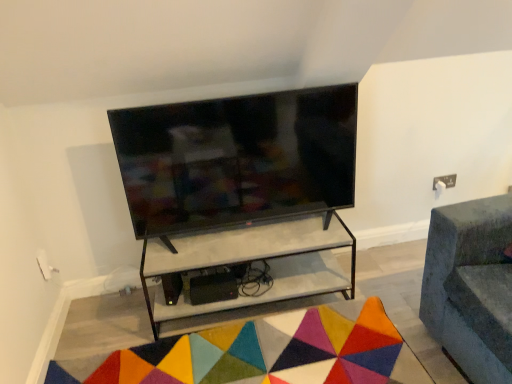
Question: Is point (138, 119) positioned closer to the camera than point (55, 377)?

Choices:
 (A) farther
 (B) closer

Answer: (B)

Question: Is matte black tv at center to the left or to the right of multicolored felt mat at lower center in the image?

Choices:
 (A) right
 (B) left

Answer: (A)

Question: Which is farther from the multicolored felt mat at lower center?

Choices:
 (A) white marble shelf at center
 (B) matte black tv at center

Answer: (B)

Question: Estimate the real-world distances between objects in this image. Which object is farther from the matte black tv at center?

Choices:
 (A) white marble shelf at center
 (B) multicolored felt mat at lower center

Answer: (B)